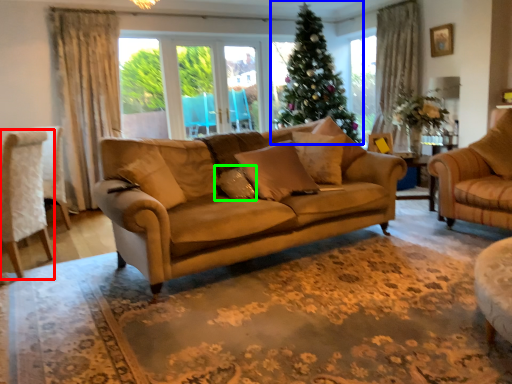
Question: Which is nearer to the chair (highlighted by a red box)? christmas tree (highlighted by a blue box) or pillow (highlighted by a green box).

Choices:
 (A) christmas tree
 (B) pillow

Answer: (B)